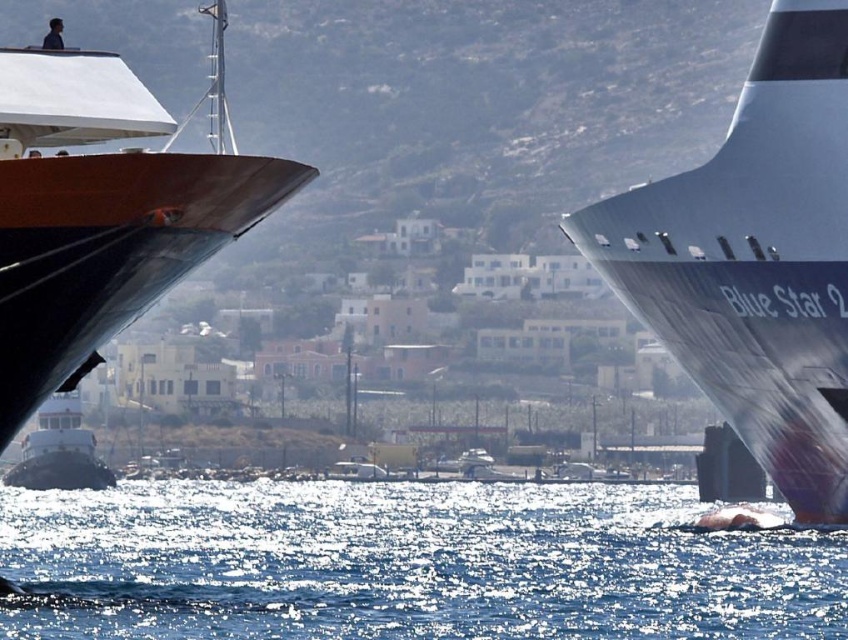
Question: Does shiny brown hull at left have a smaller size compared to white glossy tugboat at lower left?

Choices:
 (A) no
 (B) yes

Answer: (B)

Question: In this image, where is metallic gray ship at right located relative to white glossy tugboat at lower left?

Choices:
 (A) right
 (B) left

Answer: (A)

Question: Based on their relative distances, which object is farther from the white glossy tugboat at lower left?

Choices:
 (A) shiny brown hull at left
 (B) blue water at lower center
 (C) metallic gray ship at right

Answer: (A)

Question: Does metallic gray ship at right appear on the right side of shiny brown hull at left?

Choices:
 (A) yes
 (B) no

Answer: (A)

Question: Which point appears farthest from the camera in this image?

Choices:
 (A) (114, 481)
 (B) (712, 298)
 (C) (74, 346)
 (D) (333, 508)

Answer: (A)

Question: Which point is closer to the camera?

Choices:
 (A) metallic gray ship at right
 (B) shiny brown hull at left
 (C) blue water at lower center
 (D) white glossy tugboat at lower left

Answer: (B)